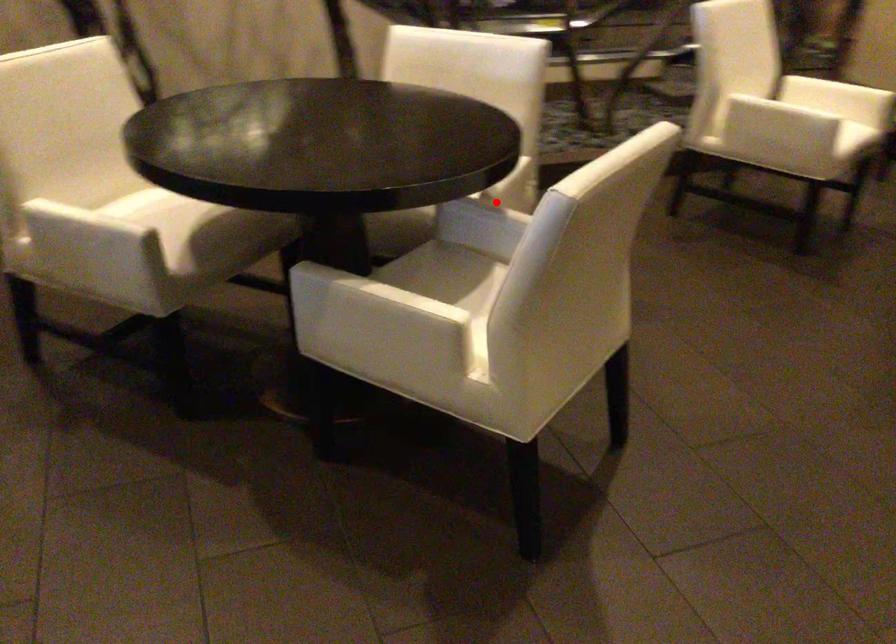
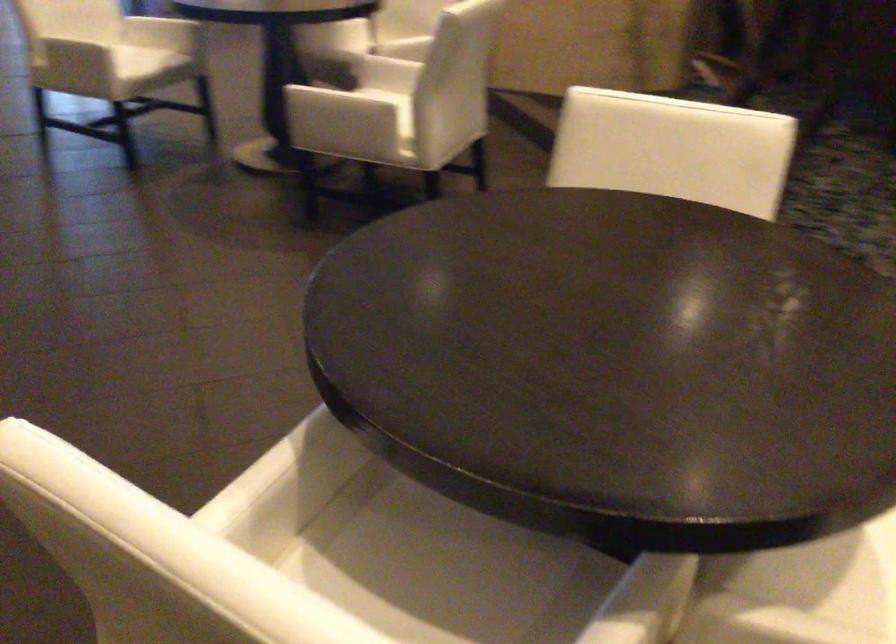
Question: I am providing you with two images of the same scene from different viewpoints. In image1, a red point is highlighted. Considering the same 3D point in image2, which of the following is correct?

Choices:
 (A) It is closer
 (B) It is farther

Answer: (A)